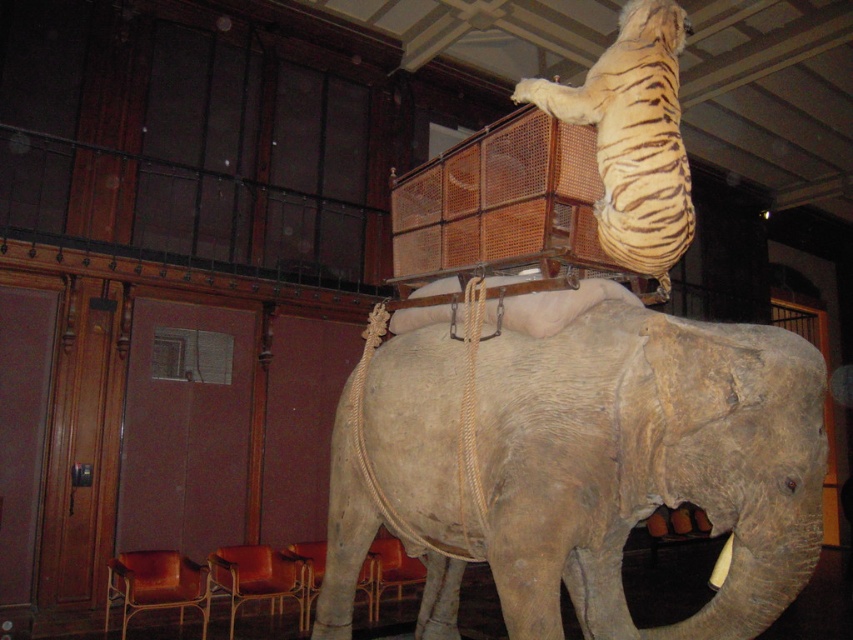
This screenshot has height=640, width=853. Describe the element at coordinates (577, 467) in the screenshot. I see `grayish-brown textured elephant at center` at that location.

This screenshot has width=853, height=640. Identify the location of grayish-brown textured elephant at center. (577, 467).